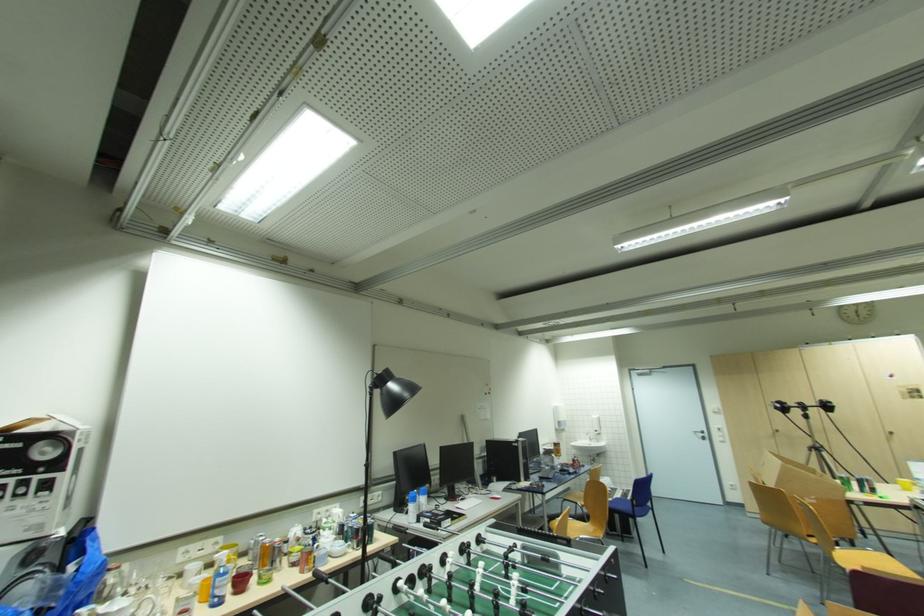
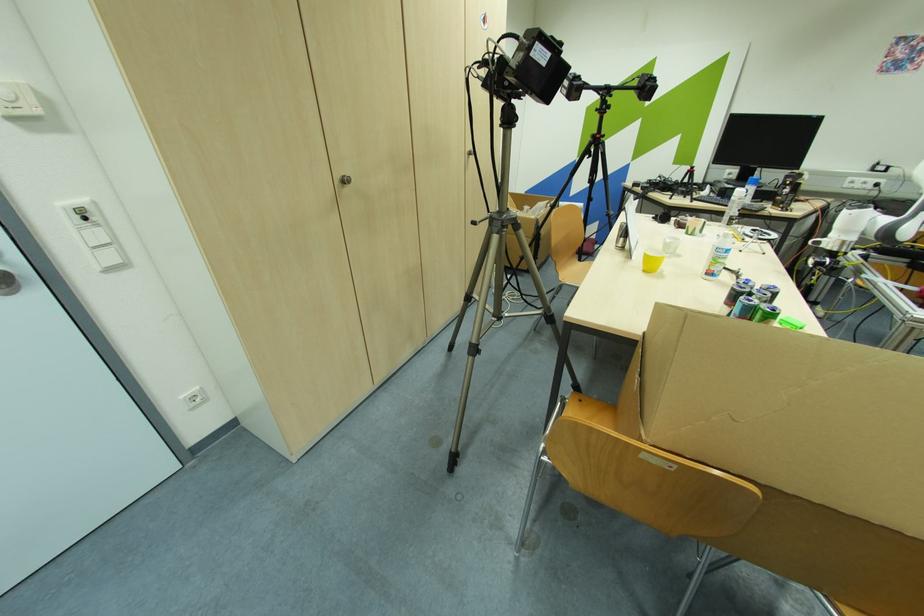
In the second image, find the point that corresponds to point (781, 431) in the first image.

(348, 182)